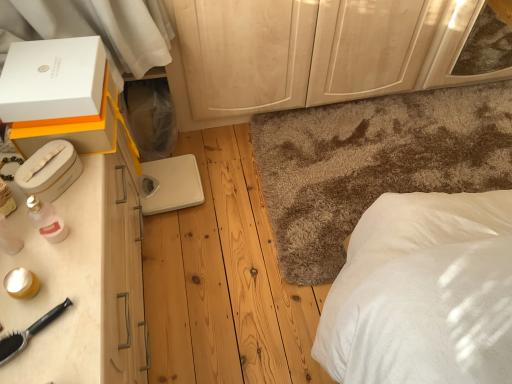
Where is `free space to the back side of pink glass perfume at left`? Image resolution: width=512 pixels, height=384 pixels. free space to the back side of pink glass perfume at left is located at coordinates (77, 189).